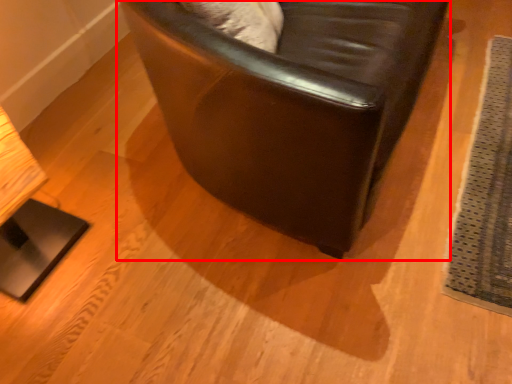
Question: From the image's perspective, considering the relative positions of chair (annotated by the red box) and mat in the image provided, where is chair (annotated by the red box) located with respect to the staircase?

Choices:
 (A) above
 (B) below

Answer: (A)